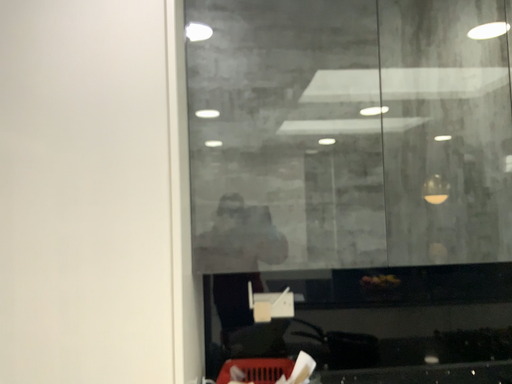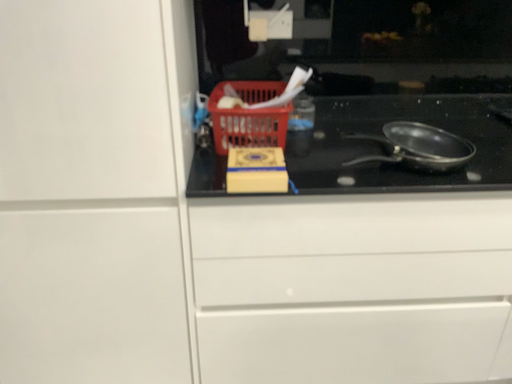
Question: How did the camera likely rotate when shooting the video?

Choices:
 (A) rotated downward
 (B) rotated upward

Answer: (A)